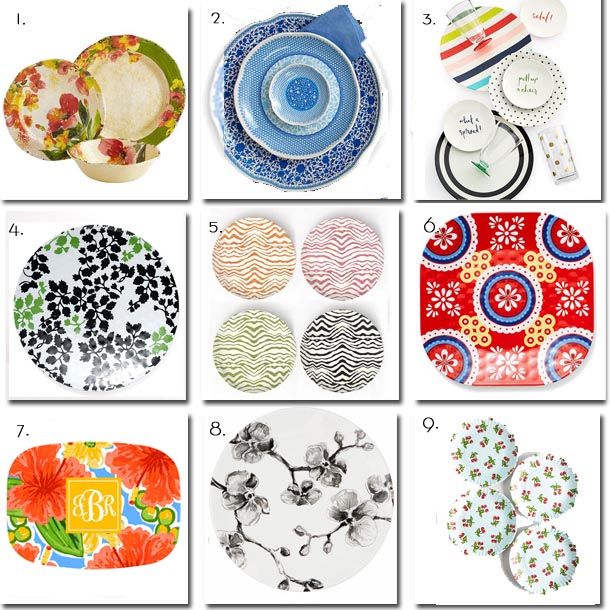
You are a GUI agent. You are given a task and a screenshot of the screen. Output one action in this format:
    pyautogui.click(x=<x>, y=<y>)
    Task: Click on the red plate with zigzags
    
    Given the screenshot: What is the action you would take?
    pyautogui.click(x=351, y=264)